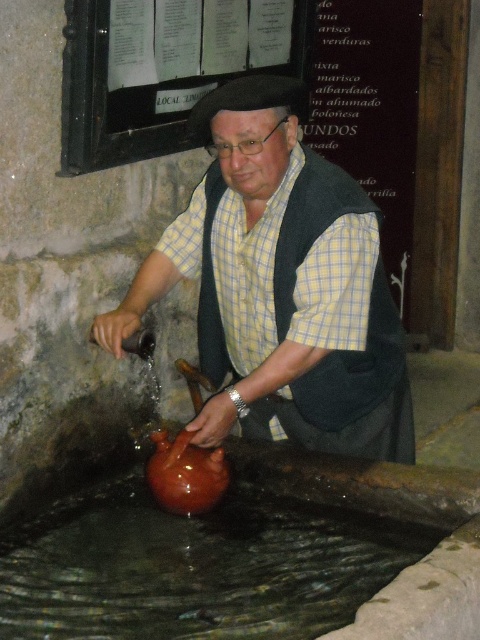
Question: Which point is closer to the camera taking this photo?

Choices:
 (A) (275, 552)
 (B) (356, 237)

Answer: (B)

Question: From the image, what is the correct spatial relationship of matte brown jug at center in relation to brown matte water at lower center?

Choices:
 (A) left
 (B) right

Answer: (B)

Question: Which of the following is the closest to the observer?

Choices:
 (A) (172, 234)
 (B) (357, 541)

Answer: (B)

Question: Does matte brown jug at center appear over brown matte water at lower center?

Choices:
 (A) yes
 (B) no

Answer: (A)

Question: Is matte brown jug at center to the right of brown matte water at lower center from the viewer's perspective?

Choices:
 (A) yes
 (B) no

Answer: (A)